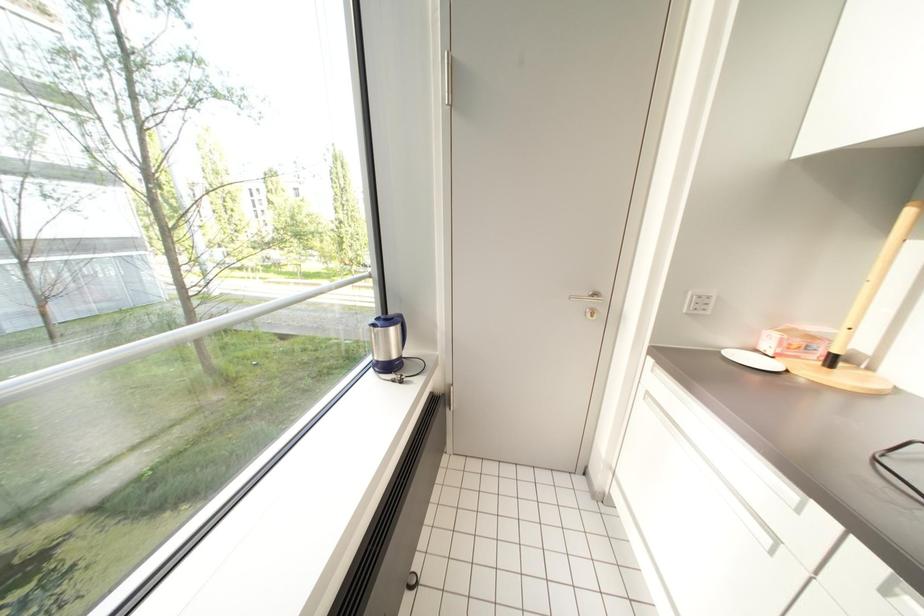
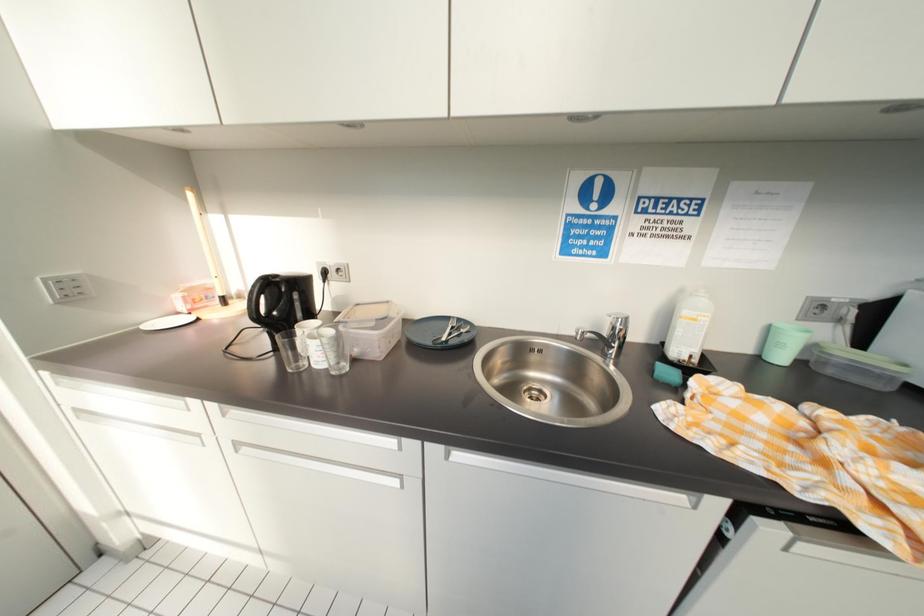
How did the camera likely rotate?

The camera's rotation is toward right-down.